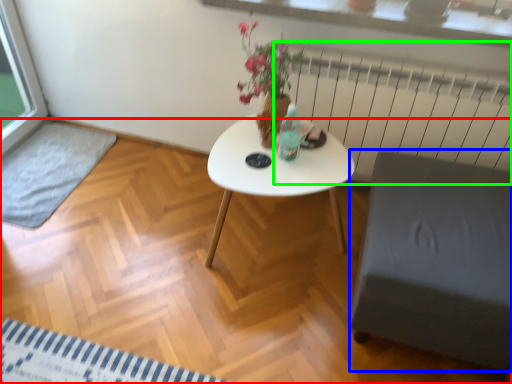
Question: Which object is the closest to the plain (highlighted by a red box)? Choose among these: armchair (highlighted by a blue box) or radiator (highlighted by a green box).

Choices:
 (A) armchair
 (B) radiator

Answer: (A)